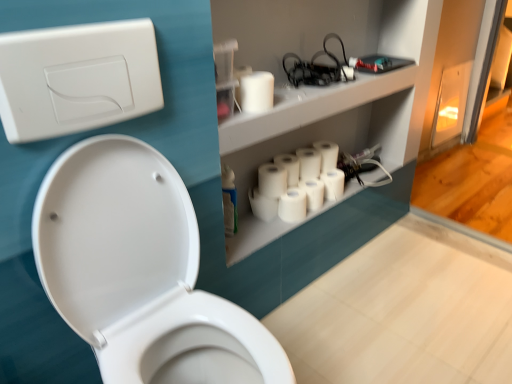
What do you see at coordinates (309, 163) in the screenshot? This screenshot has height=384, width=512. I see `white matte toilet paper at center, acting as the 3th toilet paper starting from the back` at bounding box center [309, 163].

What is the approximate height of white matte toilet paper at center, positioned as the 7th toilet paper in front-to-back order?

white matte toilet paper at center, positioned as the 7th toilet paper in front-to-back order, is 3.94 inches in height.

What do you see at coordinates (140, 272) in the screenshot?
I see `white glossy toilet at center` at bounding box center [140, 272].

The image size is (512, 384). Describe the element at coordinates (262, 205) in the screenshot. I see `white matte toilet paper at center, the 6th toilet paper in the back-to-front sequence` at that location.

The height and width of the screenshot is (384, 512). What are the coordinates of `white matte toilet paper at center, acting as the fourth toilet paper starting from the front` in the screenshot? It's located at (262, 205).

This screenshot has height=384, width=512. In order to click on white matte toilet paper at center, which ranks as the 8th toilet paper in front-to-back order in this screenshot , I will do [333, 184].

Could you tell me if white matte toilet paper at upper center, the 1th toilet paper positioned from the front, is facing white matte toilet paper at center, placed as the 3th toilet paper when sorted from front to back?

No, white matte toilet paper at upper center, the 1th toilet paper positioned from the front, is not aimed at white matte toilet paper at center, placed as the 3th toilet paper when sorted from front to back.

Is white matte toilet paper at upper center, the 1th toilet paper positioned from the front, inside or outside of white matte toilet paper at center, placed as the 3th toilet paper when sorted from front to back?

white matte toilet paper at upper center, the 1th toilet paper positioned from the front, is outside white matte toilet paper at center, placed as the 3th toilet paper when sorted from front to back.

What are the coordinates of `the 7th toilet paper above the white matte toilet paper at center, which is the seventh toilet paper from back to front (from the image's perspective)` in the screenshot? It's located at (257, 92).

Considering the relative positions of white matte toilet paper at upper center, the ninth toilet paper from the back, and white matte toilet paper at center, placed as the 3th toilet paper when sorted from front to back, in the image provided, is white matte toilet paper at upper center, the ninth toilet paper from the back, to the left of white matte toilet paper at center, placed as the 3th toilet paper when sorted from front to back, from the viewer's perspective?

Yes, white matte toilet paper at upper center, the ninth toilet paper from the back, is to the left of white matte toilet paper at center, placed as the 3th toilet paper when sorted from front to back.

Identify the location of toilet paper that is the 5th object located above the white matte toilet paper at center, the 6th toilet paper in the back-to-front sequence (from the image's perspective). (289, 167).

Is white matte toilet paper at center, acting as the fourth toilet paper starting from the front, outside of white matte toilet paper at center, the fifth toilet paper in the front-to-back sequence?

Yes, white matte toilet paper at center, acting as the fourth toilet paper starting from the front, is outside of white matte toilet paper at center, the fifth toilet paper in the front-to-back sequence.

Does white matte toilet paper at center, acting as the fourth toilet paper starting from the front, lie in front of white matte toilet paper at center, acting as the 5th toilet paper starting from the back?

Yes.

Is white matte toilet paper at center, the 6th toilet paper in the back-to-front sequence, bigger than white matte toilet paper at center, acting as the 5th toilet paper starting from the back?

No.

Which is more to the right, white matte toilet paper at center, positioned as the 7th toilet paper in front-to-back order, or white matte toilet paper at center, the fifth toilet paper in the front-to-back sequence?

white matte toilet paper at center, positioned as the 7th toilet paper in front-to-back order, is more to the right.

Is white matte toilet paper at center, positioned as the 7th toilet paper in front-to-back order, turned away from white matte toilet paper at center, the fifth toilet paper in the front-to-back sequence?

No, white matte toilet paper at center, positioned as the 7th toilet paper in front-to-back order, is not facing the opposite direction of white matte toilet paper at center, the fifth toilet paper in the front-to-back sequence.

Is white matte toilet paper at center, positioned as the 7th toilet paper in front-to-back order, next to white matte toilet paper at center, the fifth toilet paper in the front-to-back sequence, and touching it?

Yes, white matte toilet paper at center, positioned as the 7th toilet paper in front-to-back order, is next to white matte toilet paper at center, the fifth toilet paper in the front-to-back sequence.

Can you confirm if white matte toilet paper at center, acting as the 3th toilet paper starting from the back, is thinner than white matte toilet paper at center, acting as the 5th toilet paper starting from the back?

Incorrect, the width of white matte toilet paper at center, acting as the 3th toilet paper starting from the back, is not less than that of white matte toilet paper at center, acting as the 5th toilet paper starting from the back.

In the scene shown: Which of these two, white plastic/light switch at upper left or white matte toilet paper at center, positioned as the 7th toilet paper in front-to-back order, is wider?

white matte toilet paper at center, positioned as the 7th toilet paper in front-to-back order, is wider.

Which is in front, point (85, 126) or point (319, 157)?

The point (85, 126) is in front.

Is white plastic/light switch at upper left to the left or to the right of white matte toilet paper at center, acting as the 3th toilet paper starting from the back, in the image?

Based on their positions, white plastic/light switch at upper left is located to the left of white matte toilet paper at center, acting as the 3th toilet paper starting from the back.

Between white plastic/light switch at upper left and white matte toilet paper at center, acting as the 3th toilet paper starting from the back, which one has more height?

white plastic/light switch at upper left is taller.

Considering the relative sizes of white matte toilet paper at center, which is the first toilet paper in back-to-front order, and white matte toilet paper at upper center, the ninth toilet paper from the back, in the image provided, is white matte toilet paper at center, which is the first toilet paper in back-to-front order, smaller than white matte toilet paper at upper center, the ninth toilet paper from the back,?

Actually, white matte toilet paper at center, which is the first toilet paper in back-to-front order, might be larger than white matte toilet paper at upper center, the ninth toilet paper from the back.

Does white matte toilet paper at center, positioned as the 9th toilet paper in front-to-back order, lie behind white matte toilet paper at upper center, the ninth toilet paper from the back?

Yes, white matte toilet paper at center, positioned as the 9th toilet paper in front-to-back order, is behind white matte toilet paper at upper center, the ninth toilet paper from the back.

Could you measure the distance between white matte toilet paper at center, which is the first toilet paper in back-to-front order, and white matte toilet paper at upper center, the 1th toilet paper positioned from the front?

white matte toilet paper at center, which is the first toilet paper in back-to-front order, is 20.23 inches away from white matte toilet paper at upper center, the 1th toilet paper positioned from the front.

From a real-world perspective, between white matte toilet paper at center, which is the first toilet paper in back-to-front order, and white matte toilet paper at upper center, the ninth toilet paper from the back, who is vertically higher?

white matte toilet paper at upper center, the ninth toilet paper from the back, is physically above.

From a real-world perspective, is white matte toilet paper at center, positioned as the 7th toilet paper in front-to-back order, on white matte toilet paper at upper center, the 1th toilet paper positioned from the front?

Actually, white matte toilet paper at center, positioned as the 7th toilet paper in front-to-back order, is physically below white matte toilet paper at upper center, the 1th toilet paper positioned from the front, in the real world.

Considering the relative positions of white matte toilet paper at center, acting as the 3th toilet paper starting from the back, and white matte toilet paper at upper center, the ninth toilet paper from the back, in the image provided, is white matte toilet paper at center, acting as the 3th toilet paper starting from the back, to the right of white matte toilet paper at upper center, the ninth toilet paper from the back, from the viewer's perspective?

Yes.

Is white matte toilet paper at center, acting as the 3th toilet paper starting from the back, bigger than white matte toilet paper at upper center, the 1th toilet paper positioned from the front?

Yes.

Considering the sizes of objects white matte toilet paper at center, acting as the 3th toilet paper starting from the back, and white matte toilet paper at upper center, the ninth toilet paper from the back, in the image provided, who is shorter, white matte toilet paper at center, acting as the 3th toilet paper starting from the back, or white matte toilet paper at upper center, the ninth toilet paper from the back,?

Standing shorter between the two is white matte toilet paper at upper center, the ninth toilet paper from the back.

Is white matte toilet paper at center, marked as the second toilet paper in a front-to-back arrangement, surrounding white matte toilet paper at center, the 6th toilet paper in the back-to-front sequence?

Actually, white matte toilet paper at center, the 6th toilet paper in the back-to-front sequence, is outside white matte toilet paper at center, marked as the second toilet paper in a front-to-back arrangement.

From a real-world perspective, which toilet paper is the 5th one underneath the white matte toilet paper at center, arranged as the eighth toilet paper when viewed from the back? Please provide its 2D coordinates.

[(262, 205)]

Are white matte toilet paper at center, arranged as the eighth toilet paper when viewed from the back, and white matte toilet paper at center, the 6th toilet paper in the back-to-front sequence, located far from each other?

white matte toilet paper at center, arranged as the eighth toilet paper when viewed from the back, is near white matte toilet paper at center, the 6th toilet paper in the back-to-front sequence, not far away.

Measure the distance from white matte toilet paper at center, marked as the second toilet paper in a front-to-back arrangement, to white matte toilet paper at center, the 6th toilet paper in the back-to-front sequence.

They are 2.42 inches apart.

Find the location of a particular element. This screenshot has width=512, height=384. toilet paper that is the 2nd one when counting backward from the white matte toilet paper at upper center, the 1th toilet paper positioned from the front is located at coordinates (292, 205).

In order to click on toilet paper that is the 5th one when counting downward from the white matte toilet paper at center, acting as the 5th toilet paper starting from the back (from the image's perspective) in this screenshot , I will do `click(262, 205)`.

Considering their positions, is white matte toilet paper at upper center, the 1th toilet paper positioned from the front, positioned closer to white matte toilet paper at center, the 6th toilet paper in the back-to-front sequence, than white matte toilet paper at center, the 4th toilet paper viewed from the back?

white matte toilet paper at center, the 4th toilet paper viewed from the back.

In the scene shown: Considering their positions, is white matte toilet paper at center, which is the seventh toilet paper from back to front, positioned closer to white matte toilet paper at center, which ranks as the 8th toilet paper in front-to-back order, than white matte toilet paper at upper center, the 1th toilet paper positioned from the front?

white matte toilet paper at center, which is the seventh toilet paper from back to front.

Which object lies nearer to the anchor point white matte toilet paper at center, which is the first toilet paper in back-to-front order, white plastic/light switch at upper left or white matte toilet paper at center, positioned as the sixth toilet paper in front-to-back order?

Based on the image, white matte toilet paper at center, positioned as the sixth toilet paper in front-to-back order, appears to be nearer to white matte toilet paper at center, which is the first toilet paper in back-to-front order.

Based on their spatial positions, is white matte toilet paper at center, placed as the 3th toilet paper when sorted from front to back, or white matte toilet paper at center, the fifth toilet paper in the front-to-back sequence, closer to white matte toilet paper at center, the 6th toilet paper in the back-to-front sequence?

white matte toilet paper at center, placed as the 3th toilet paper when sorted from front to back, is closer to white matte toilet paper at center, the 6th toilet paper in the back-to-front sequence.

From the image, which object appears to be farther from white matte toilet paper at center, positioned as the 9th toilet paper in front-to-back order, white glossy toilet at center or white matte toilet paper at upper center, the ninth toilet paper from the back?

The object further to white matte toilet paper at center, positioned as the 9th toilet paper in front-to-back order, is white glossy toilet at center.

Looking at the image, which one is located further to white glossy toilet at center, white matte toilet paper at upper center, the ninth toilet paper from the back, or white matte toilet paper at center, the 6th toilet paper in the back-to-front sequence?

white matte toilet paper at center, the 6th toilet paper in the back-to-front sequence, is further to white glossy toilet at center.

When comparing their distances from white matte toilet paper at upper center, the ninth toilet paper from the back, does white glossy toilet at center or white matte toilet paper at center, marked as the second toilet paper in a front-to-back arrangement, seem further?

white glossy toilet at center is further to white matte toilet paper at upper center, the ninth toilet paper from the back.

Based on the photo, when comparing their distances from white matte toilet paper at center, acting as the 3th toilet paper starting from the back, does white glossy toilet at center or white matte toilet paper at center, acting as the 5th toilet paper starting from the back, seem further?

The object further to white matte toilet paper at center, acting as the 3th toilet paper starting from the back, is white glossy toilet at center.

I want to click on light switch located between white glossy toilet at center and white matte toilet paper at center, marked as the second toilet paper in a front-to-back arrangement, in the depth direction, so click(77, 78).

The image size is (512, 384). Find the location of `light switch between white glossy toilet at center and white matte toilet paper at center, which ranks as the 8th toilet paper in front-to-back order, along the z-axis`. light switch between white glossy toilet at center and white matte toilet paper at center, which ranks as the 8th toilet paper in front-to-back order, along the z-axis is located at coordinates 77,78.

The width and height of the screenshot is (512, 384). Find the location of `light switch between white glossy toilet at center and white matte toilet paper at center, the 4th toilet paper viewed from the back, in the front-back direction`. light switch between white glossy toilet at center and white matte toilet paper at center, the 4th toilet paper viewed from the back, in the front-back direction is located at coordinates (77, 78).

Locate an element on the screen. toilet paper between white matte toilet paper at upper center, the 1th toilet paper positioned from the front, and white matte toilet paper at center, placed as the 3th toilet paper when sorted from front to back, from front to back is located at coordinates (272, 180).